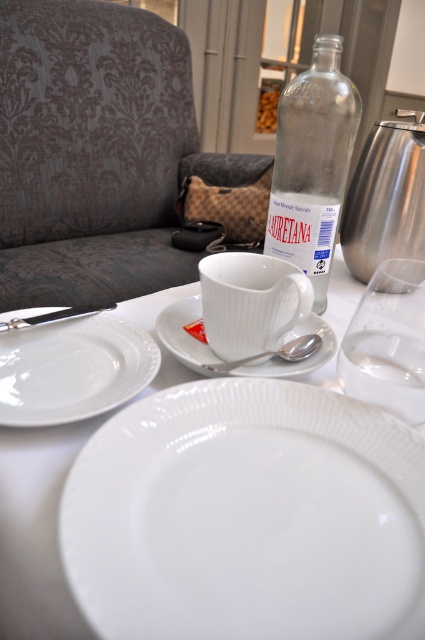
Does transparent glass bottle at upper center have a lesser width compared to brushed metal teapot at upper right?

Incorrect, transparent glass bottle at upper center's width is not less than brushed metal teapot at upper right's.

Describe the element at coordinates (312, 164) in the screenshot. I see `transparent glass bottle at upper center` at that location.

Measure the distance between transparent glass bottle at upper center and camera.

transparent glass bottle at upper center is 19.89 inches away from camera.

The width and height of the screenshot is (425, 640). Identify the location of transparent glass bottle at upper center. (312, 164).

Find the location of a particular element. The width and height of the screenshot is (425, 640). white glossy platter at center is located at coordinates (246, 516).

Can you confirm if white glossy platter at center is positioned below brushed metal teapot at upper right?

Yes.

Find the location of a particular element. This screenshot has height=640, width=425. white glossy platter at center is located at coordinates (246, 516).

Between point (269, 365) and point (234, 369), which one is positioned behind?

Positioned behind is point (269, 365).

Describe the element at coordinates (186, 333) in the screenshot. The image size is (425, 640). I see `white ceramic saucer at center` at that location.

I want to click on white ceramic saucer at center, so click(186, 333).